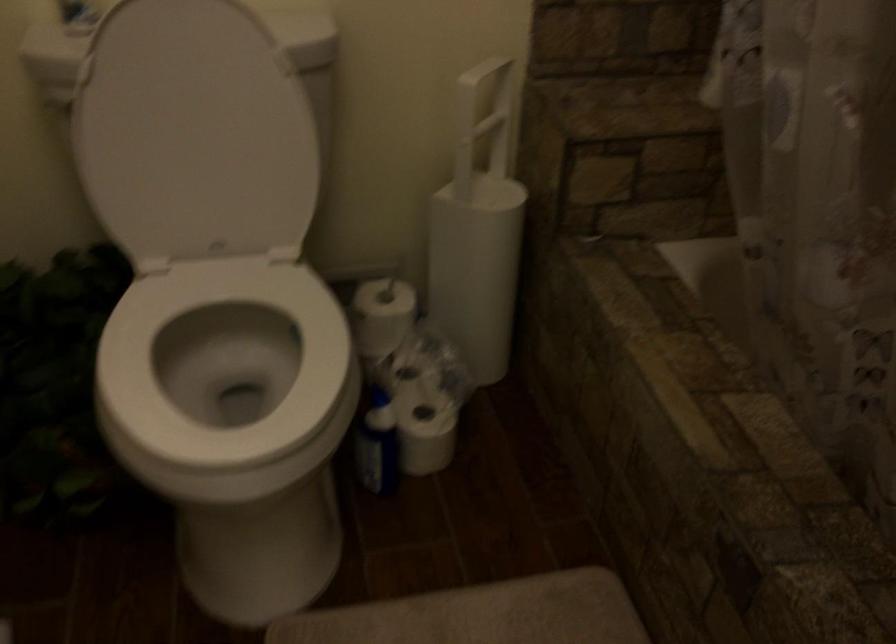
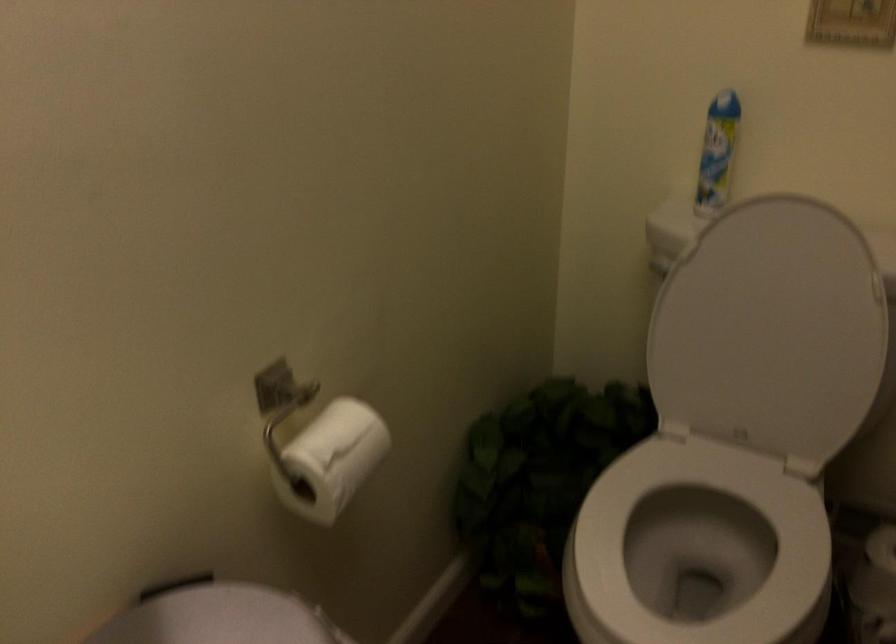
Find the pixel in the second image that matches point 233,368 in the first image.

(698, 547)